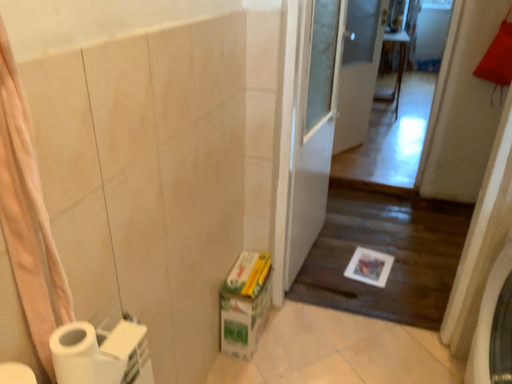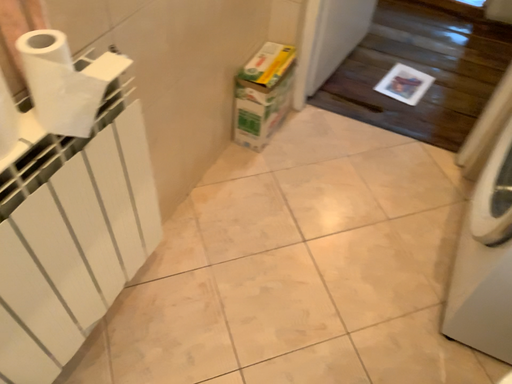
Question: Which way did the camera rotate in the video?

Choices:
 (A) rotated downward
 (B) rotated upward

Answer: (A)